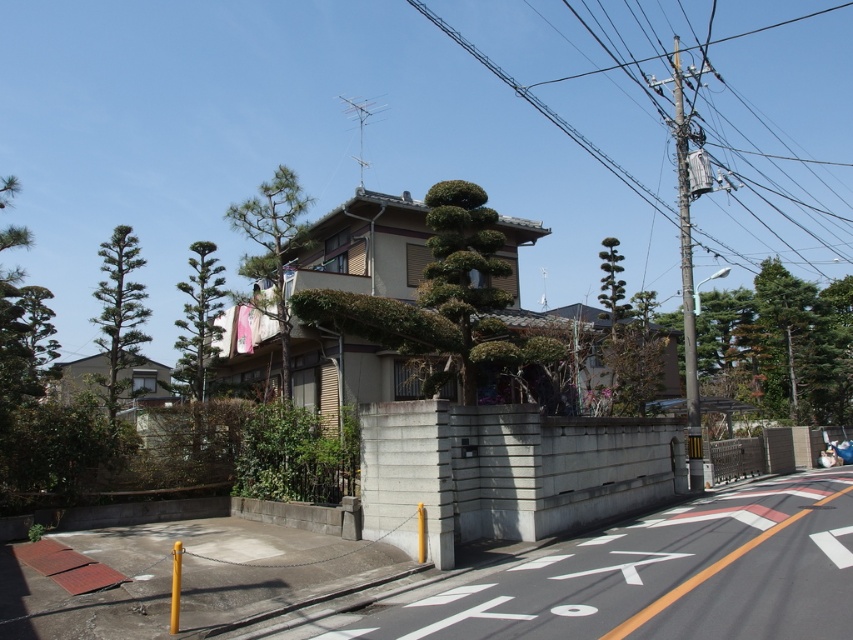
Looking at this image, is green textured tree at upper center bigger than green leafy tree at center-right?

Yes.

Which is more to the left, green textured tree at upper center or green leafy tree at center-right?

green textured tree at upper center is more to the left.

Is point (283, 220) in front of point (616, 301)?

Yes, point (283, 220) is in front of point (616, 301).

Where is `green textured tree at upper center`? This screenshot has height=640, width=853. green textured tree at upper center is located at coordinates (271, 250).

Is point (846, 116) less distant than point (465, 260)?

No.

Which is behind, point (518, 33) or point (433, 196)?

Point (518, 33)

Where is `metallic wire at upper center`? The height and width of the screenshot is (640, 853). metallic wire at upper center is located at coordinates (531, 132).

Is point (461, 220) less distant than point (614, 259)?

That is True.

Who is more forward, (468,292) or (602,298)?

Point (468,292) is more forward.

This screenshot has height=640, width=853. In order to click on green leafy bush at center in this screenshot , I will do `click(467, 276)`.